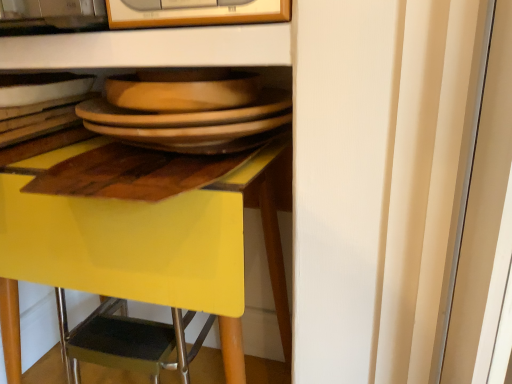
Question: Is wooden frame at upper center bigger or smaller than matte white bowl at upper left?

Choices:
 (A) small
 (B) big

Answer: (B)

Question: Looking at their shapes, would you say wooden frame at upper center is wider or thinner than matte white bowl at upper left?

Choices:
 (A) thin
 (B) wide

Answer: (A)

Question: Estimate the real-world distances between objects in this image. Which object is farther from the matte wooden platter at center?

Choices:
 (A) brown matte plate at center
 (B) matte white bowl at upper left
 (C) yellow glossy desk at center
 (D) wooden frame at upper center

Answer: (C)

Question: Estimate the real-world distances between objects in this image. Which object is closer to the matte wooden platter at center?

Choices:
 (A) wooden frame at upper center
 (B) yellow glossy desk at center
 (C) matte white bowl at upper left
 (D) brown matte plate at center

Answer: (D)